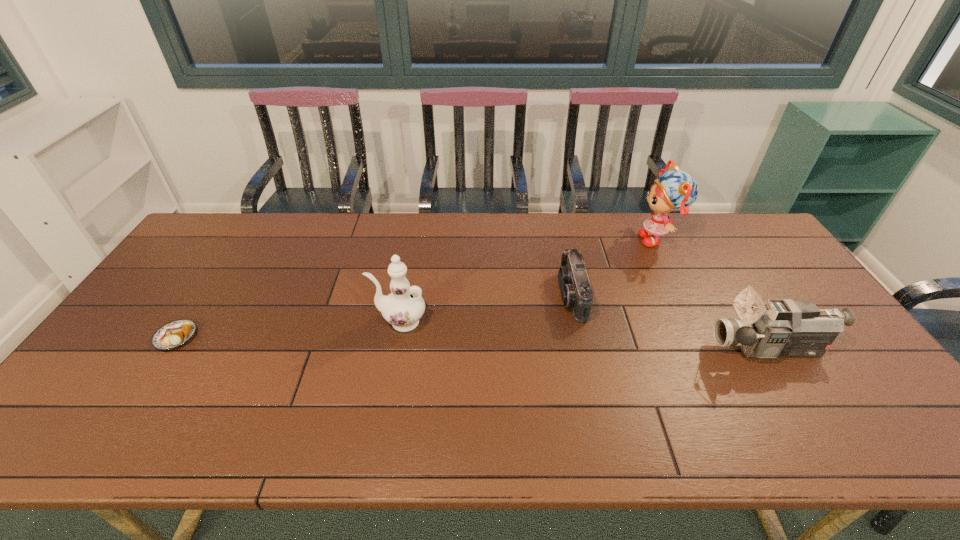
I want to click on the farthest object, so click(675, 190).

Identify the location of the fourth object from right to left. (402, 308).

This screenshot has width=960, height=540. What are the coordinates of `the third tallest object` in the screenshot? It's located at (776, 328).

Find the location of a particular element. The height and width of the screenshot is (540, 960). the right camcorder is located at coordinates (776, 328).

In order to click on the shorter camcorder in this screenshot , I will do `click(575, 288)`.

Image resolution: width=960 pixels, height=540 pixels. Identify the location of the fourth tallest object. (575, 288).

The width and height of the screenshot is (960, 540). What are the coordinates of `the shortest object` in the screenshot? It's located at (174, 334).

This screenshot has width=960, height=540. Find the location of `pastry`. pastry is located at coordinates (174, 334).

The width and height of the screenshot is (960, 540). Identify the location of free point located on the face of the doll. (531, 239).

Locate an element on the screen. vacant space situated 0.130m on the face of the doll is located at coordinates (599, 239).